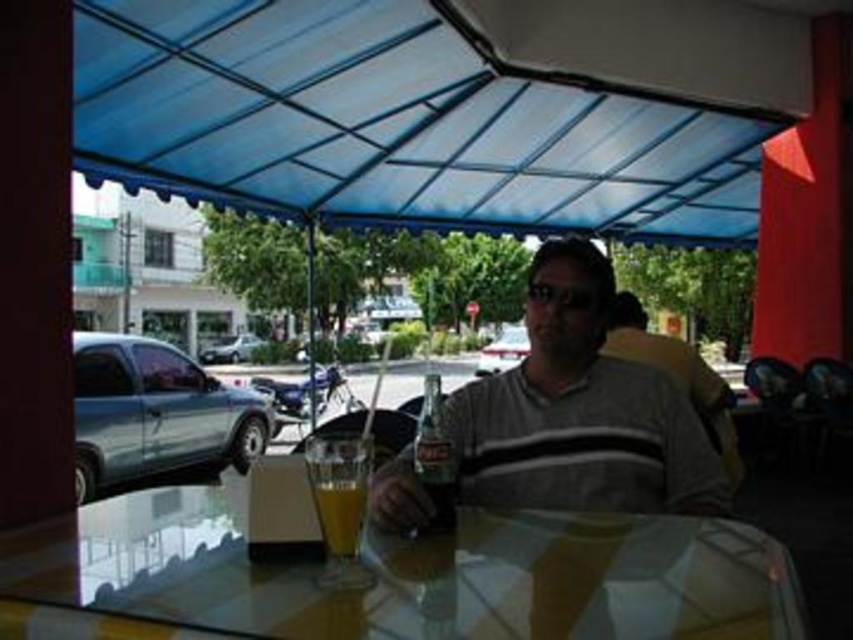
Question: Which point is closer to the camera?

Choices:
 (A) transparent glass table at center
 (B) translucent glass cup at table center
 (C) gray cotton shirt at center
 (D) blue fabric canopy at upper center

Answer: (A)

Question: From the image, what is the correct spatial relationship of transparent glass table at center in relation to gray cotton shirt at center?

Choices:
 (A) right
 (B) left

Answer: (B)

Question: Which point is closer to the camera?

Choices:
 (A) transparent glass table at center
 (B) blue fabric canopy at upper center

Answer: (A)

Question: Estimate the real-world distances between objects in this image. Which object is closer to the blue fabric canopy at upper center?

Choices:
 (A) gray cotton shirt at center
 (B) transparent glass table at center
 (C) translucent glass cup at table center

Answer: (A)

Question: Can you confirm if gray cotton shirt at center is positioned to the right of translucent glass cup at table center?

Choices:
 (A) no
 (B) yes

Answer: (B)

Question: Does transparent glass table at center come in front of translucent glass cup at table center?

Choices:
 (A) yes
 (B) no

Answer: (A)